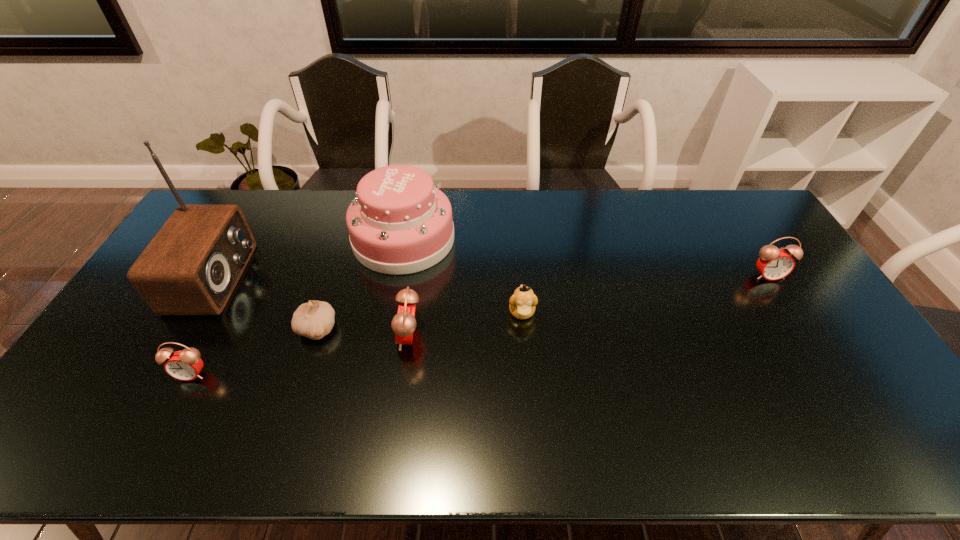
Identify the location of vacant area situated 0.050m on the clock face of the second nearest alarm clock. Image resolution: width=960 pixels, height=540 pixels. (379, 336).

I want to click on free space located 0.240m on the clock face of the second nearest alarm clock, so click(311, 336).

Locate an element on the screen. This screenshot has width=960, height=540. blank space located 0.340m on the clock face of the second nearest alarm clock is located at coordinates (276, 336).

You are a GUI agent. You are given a task and a screenshot of the screen. Output one action in this format:
    pyautogui.click(x=<x>, y=<y>)
    Task: Click on the free space located on the clock face of the rightmost object
    
    Given the screenshot: What is the action you would take?
    pyautogui.click(x=822, y=361)

The height and width of the screenshot is (540, 960). Identify the location of free space located 0.400m on the left of the sixth shortest object. (236, 239).

Locate an element on the screen. Image resolution: width=960 pixels, height=540 pixels. free point located 0.120m on the front-facing side of the tallest object is located at coordinates (284, 279).

At what (x,y) coordinates should I click in order to perform the action: click on vacant space located on the right of the garlic. Please return your answer as a coordinate pair (x, y). Looking at the image, I should click on (416, 329).

This screenshot has width=960, height=540. In order to click on free space located on the face of the second object from right to left in this screenshot , I will do `click(530, 403)`.

You are a GUI agent. You are given a task and a screenshot of the screen. Output one action in this format:
    pyautogui.click(x=<x>, y=<y>)
    Task: Click on the object positioned at the far edge
    Image resolution: width=960 pixels, height=540 pixels.
    Given the screenshot: What is the action you would take?
    pyautogui.click(x=400, y=223)

In order to click on object that is at the near edge in this screenshot , I will do `click(185, 365)`.